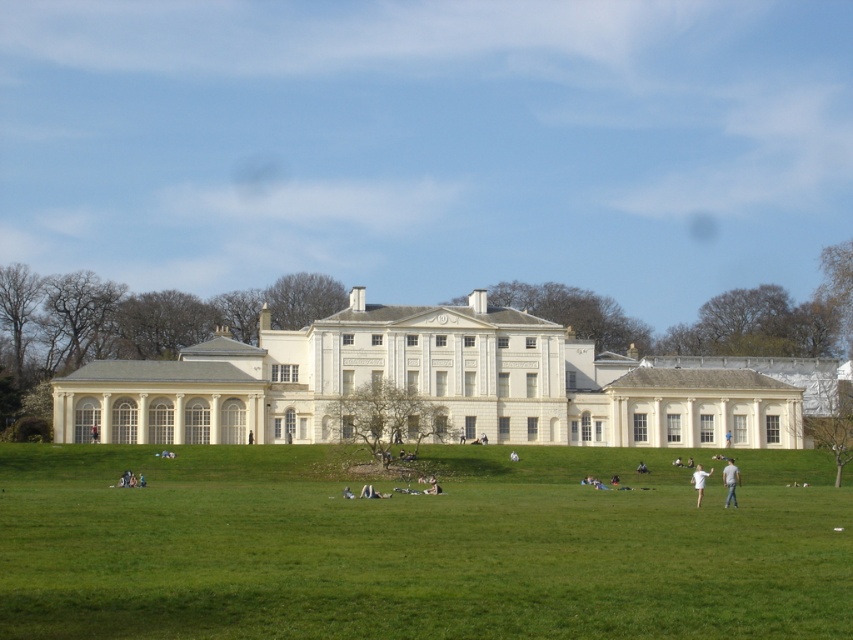
You are standing on the lawn in front of the building and want to walk from point (259, 436) to point (734, 499). Which direction should you move relative to the building?

You should move away from the building because point (734, 499) is further away from the building than point (259, 436).

Consider the image. You are standing at the center of the lawn in front of the classical building. You want to find the light brown leather jacket at lower right. Which direction should you walk to reach it?

The light brown leather jacket at lower right is located at point 0.753 on the x axis and 0.857 on the y axis. Since you are at the center, you should walk towards the lower right direction to reach it.